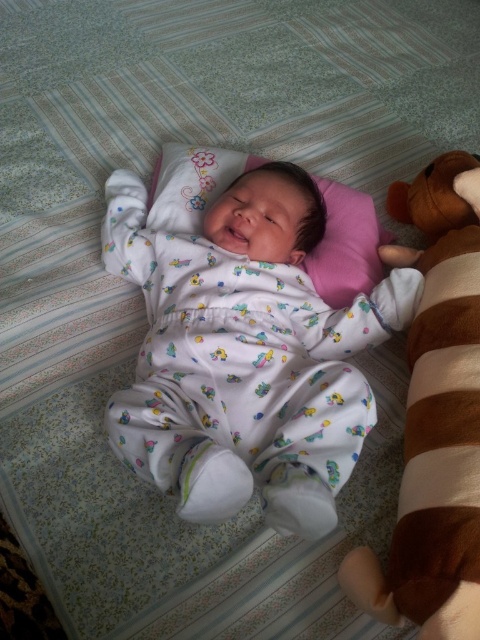
Question: Estimate the real-world distances between objects in this image. Which object is closer to the white cotton onesie at center?

Choices:
 (A) pink fabric pillow at center
 (B) brown plush bear at right

Answer: (A)

Question: Which point is farther to the camera?

Choices:
 (A) pink fabric pillow at center
 (B) white cotton onesie at center

Answer: (A)

Question: Does white cotton onesie at center lie in front of brown plush bear at right?

Choices:
 (A) yes
 (B) no

Answer: (B)

Question: Does white cotton onesie at center appear on the right side of brown plush bear at right?

Choices:
 (A) no
 (B) yes

Answer: (A)

Question: Which point appears closest to the camera in this image?

Choices:
 (A) (422, 465)
 (B) (249, 408)

Answer: (A)

Question: Can you confirm if white cotton onesie at center is positioned below brown plush bear at right?

Choices:
 (A) yes
 (B) no

Answer: (B)